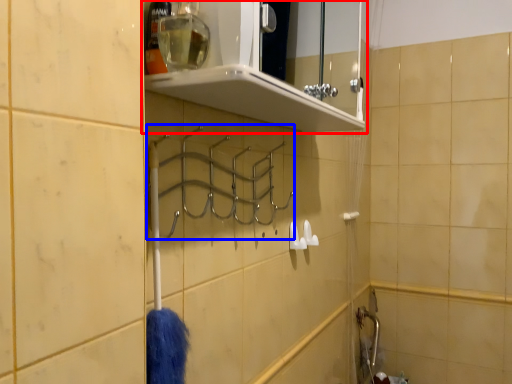
Question: Which of the following is the closest to the observer, shelf (highlighted by a red box) or hanger (highlighted by a blue box)?

Choices:
 (A) shelf
 (B) hanger

Answer: (A)